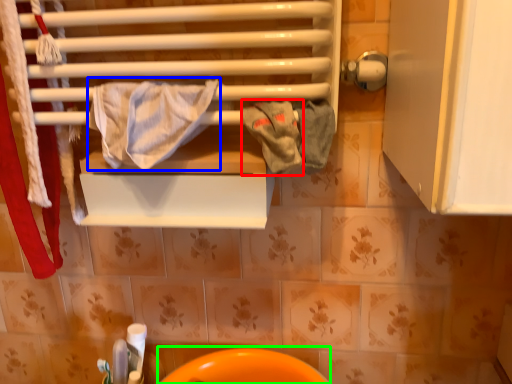
Question: Based on their relative distances, which object is nearer to bath towel (highlighted by a red box)? Choose from bath towel (highlighted by a blue box) and sink (highlighted by a green box).

Choices:
 (A) bath towel
 (B) sink

Answer: (A)